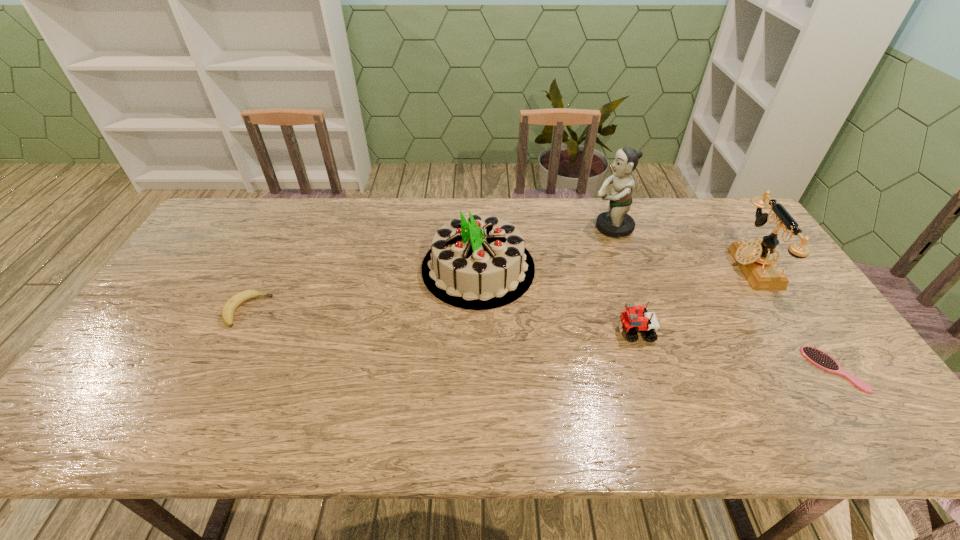
Locate an element on the screen. Image resolution: width=960 pixels, height=540 pixels. the tallest object is located at coordinates (616, 222).

Where is `birthday cake`? This screenshot has width=960, height=540. birthday cake is located at coordinates (477, 262).

Locate an element on the screen. This screenshot has height=540, width=960. telephone is located at coordinates (756, 260).

In order to click on Lego in this screenshot , I will do `click(631, 323)`.

Locate an element on the screen. Image resolution: width=960 pixels, height=540 pixels. the fifth tallest object is located at coordinates point(231,305).

Locate an element on the screen. the leftmost object is located at coordinates (231, 305).

Where is `the nearest object`? The width and height of the screenshot is (960, 540). the nearest object is located at coordinates (817, 357).

Locate an element on the screen. the shortest object is located at coordinates (817, 357).

Identify the location of vacant region located 0.090m on the front-facing side of the tallest object. (564, 227).

Locate an element on the screen. free space located 0.260m on the front-facing side of the tallest object is located at coordinates (514, 227).